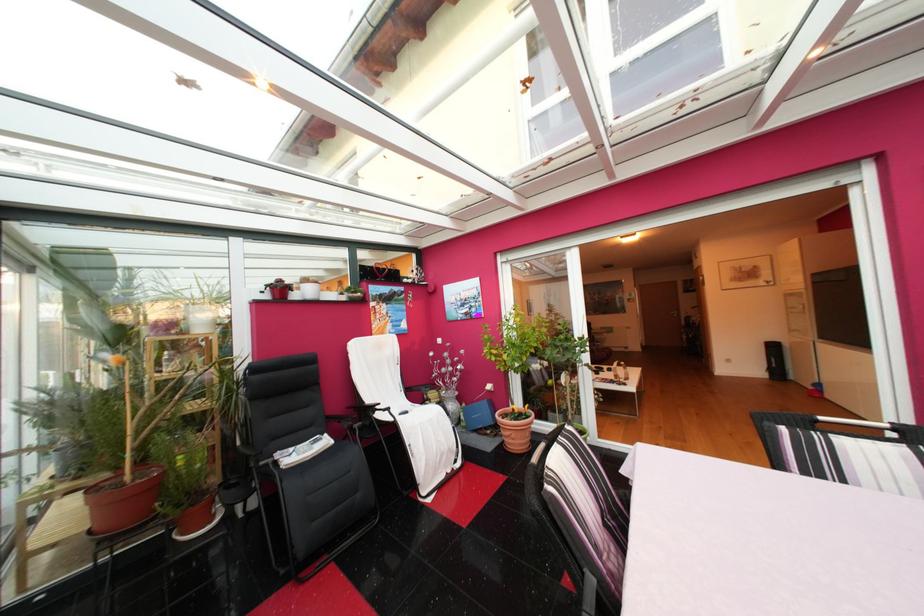
What do you see at coordinates (400, 411) in the screenshot?
I see `a white chair sitting surface` at bounding box center [400, 411].